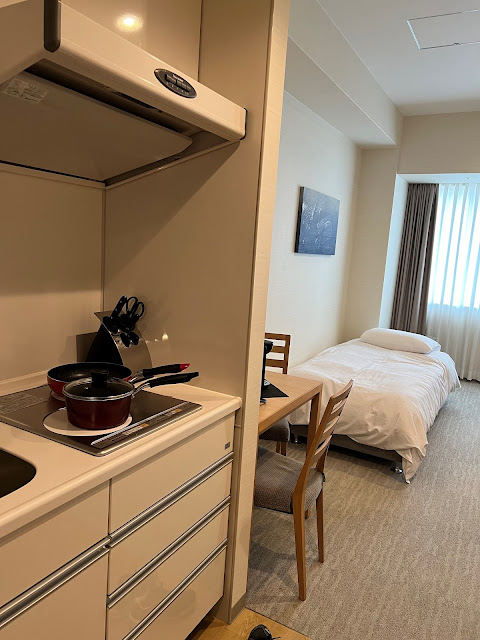
Can you see any where you'd sit in the image? Point to them. Your answer should be formatted as a list of tuples, i.e. [(x1, y1), (x2, y2), ...], where each tuple contains the x and y coordinates of a point satisfying the conditions above.

[(278, 427), (278, 461)]